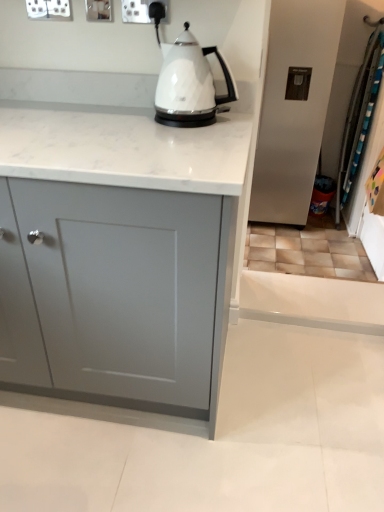
Question: Considering the relative sizes of white plastic socket at upper center and matte gray cabinet at center in the image provided, is white plastic socket at upper center shorter than matte gray cabinet at center?

Choices:
 (A) no
 (B) yes

Answer: (B)

Question: Considering the relative sizes of white plastic socket at upper center and matte gray cabinet at center in the image provided, is white plastic socket at upper center bigger than matte gray cabinet at center?

Choices:
 (A) no
 (B) yes

Answer: (A)

Question: From a real-world perspective, is white plastic socket at upper center positioned over matte gray cabinet at center based on gravity?

Choices:
 (A) no
 (B) yes

Answer: (B)

Question: From the image's perspective, would you say white plastic socket at upper center is positioned over matte gray cabinet at center?

Choices:
 (A) yes
 (B) no

Answer: (A)

Question: Is white plastic socket at upper center at the right side of matte gray cabinet at center?

Choices:
 (A) no
 (B) yes

Answer: (B)

Question: Is white plastic socket at upper center looking in the opposite direction of matte gray cabinet at center?

Choices:
 (A) yes
 (B) no

Answer: (B)

Question: Does white glossy kettle at center come in front of white plastic socket at upper center?

Choices:
 (A) yes
 (B) no

Answer: (A)

Question: Is white glossy kettle at center oriented towards white plastic socket at upper center?

Choices:
 (A) yes
 (B) no

Answer: (B)

Question: Is white glossy kettle at center bigger than white plastic socket at upper center?

Choices:
 (A) no
 (B) yes

Answer: (B)

Question: Is white plastic socket at upper center located within white glossy kettle at center?

Choices:
 (A) no
 (B) yes

Answer: (A)

Question: From a real-world perspective, is white glossy kettle at center on white plastic socket at upper center?

Choices:
 (A) no
 (B) yes

Answer: (A)

Question: From a real-world perspective, does white glossy kettle at center sit lower than white plastic socket at upper center?

Choices:
 (A) no
 (B) yes

Answer: (B)

Question: Does white plastic socket at upper center turn towards white glossy kettle at center?

Choices:
 (A) no
 (B) yes

Answer: (A)